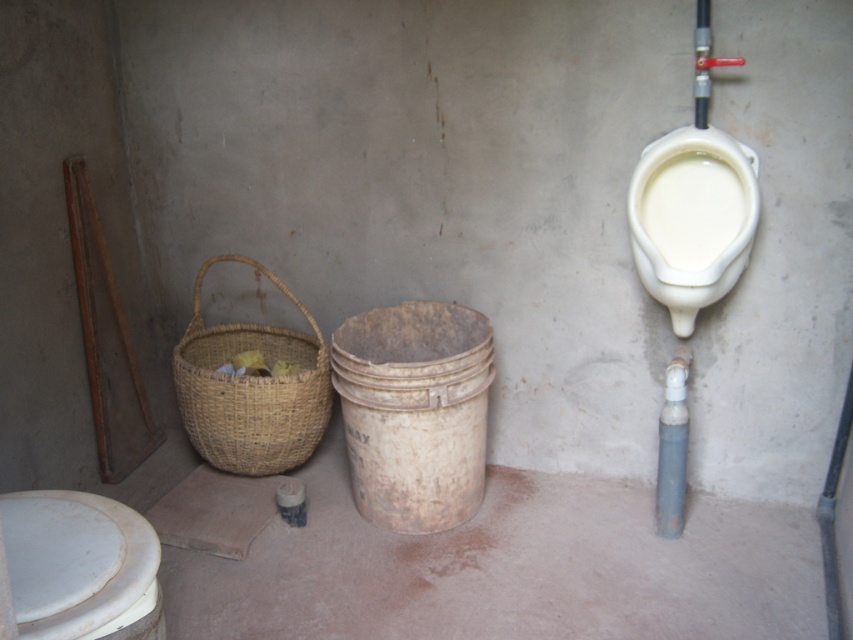
Question: Can you confirm if white glossy toilet bowl at lower left is bigger than white glossy urinal at upper right?

Choices:
 (A) no
 (B) yes

Answer: (B)

Question: Can you confirm if white glossy toilet bowl at lower left is positioned below white glossy urinal at upper right?

Choices:
 (A) no
 (B) yes

Answer: (B)

Question: Which of the following is the farthest from the observer?

Choices:
 (A) click(740, 234)
 (B) click(39, 620)
 (C) click(242, 384)

Answer: (C)

Question: Which object appears farthest from the camera in this image?

Choices:
 (A) white glossy toilet bowl at lower left
 (B) woven straw basket at lower left
 (C) white glossy urinal at upper right

Answer: (B)

Question: Does woven straw basket at lower left have a lesser width compared to white glossy urinal at upper right?

Choices:
 (A) no
 (B) yes

Answer: (A)

Question: Which is farther from the woven straw basket at lower left?

Choices:
 (A) white glossy urinal at upper right
 (B) white glossy toilet bowl at lower left

Answer: (A)